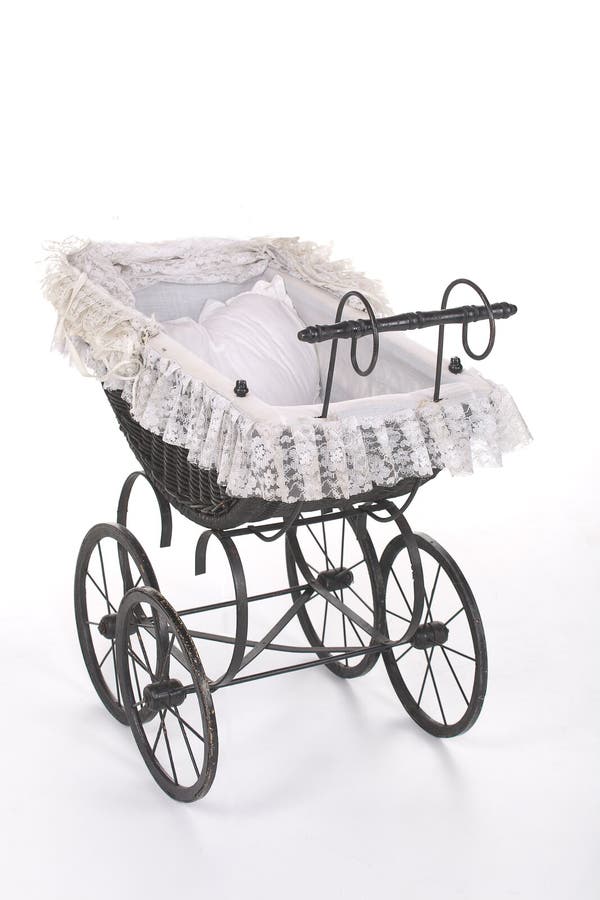
The height and width of the screenshot is (900, 600). I want to click on pillow, so click(x=238, y=351).